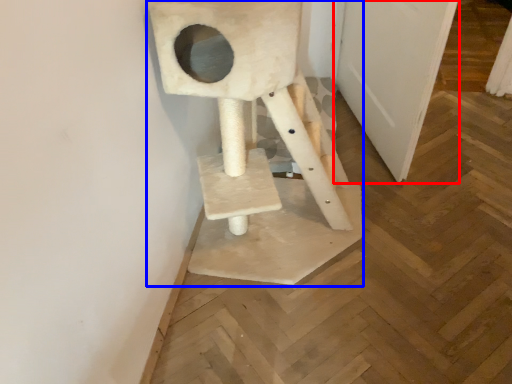
Question: Which of the following is the closest to the observer, door (highlighted by a red box) or sculpture (highlighted by a blue box)?

Choices:
 (A) door
 (B) sculpture

Answer: (B)